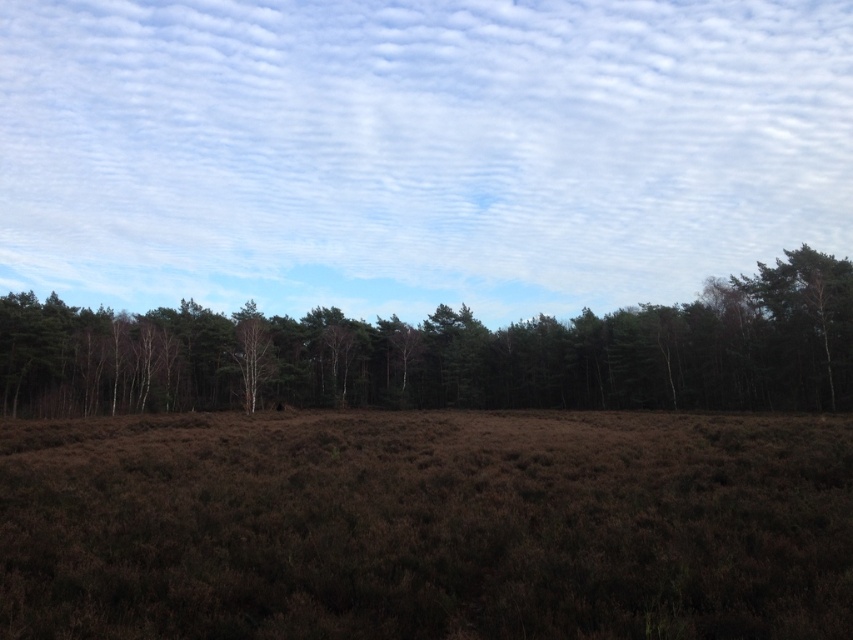
Question: Which point is farther to the camera?

Choices:
 (A) click(155, 506)
 (B) click(26, 364)

Answer: (B)

Question: Which of these objects is positioned closest to the brown grassland at center?

Choices:
 (A) white fluffy cloud at upper center
 (B) brown textured trees at center
 (C) white bark tree at center

Answer: (B)

Question: Can you confirm if brown textured trees at center is positioned to the left of white bark tree at center?

Choices:
 (A) no
 (B) yes

Answer: (A)

Question: Which object appears farthest from the camera in this image?

Choices:
 (A) white fluffy cloud at upper center
 (B) white bark tree at center
 (C) brown grassland at center
 (D) brown textured trees at center

Answer: (A)

Question: Does brown grassland at center have a larger size compared to white bark tree at center?

Choices:
 (A) no
 (B) yes

Answer: (A)

Question: Can you confirm if white fluffy cloud at upper center is positioned to the right of brown grassland at center?

Choices:
 (A) no
 (B) yes

Answer: (A)